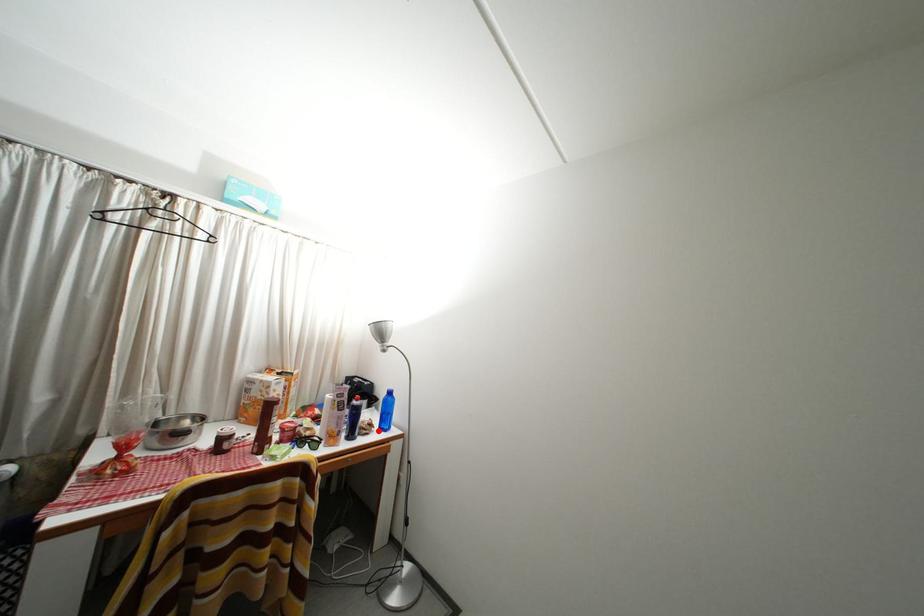
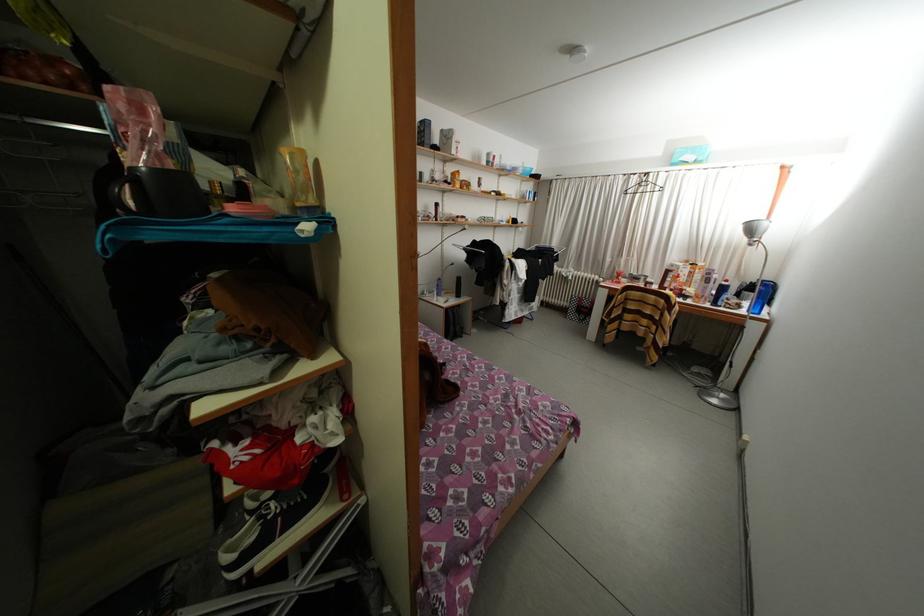
Question: I am providing you with two images of the same scene from different viewpoints. Image1 has a red point marked. In image2, the corresponding 3D location appears at what relative position? Reply with the corresponding letter.

Choices:
 (A) Closer
 (B) Farther

Answer: (A)